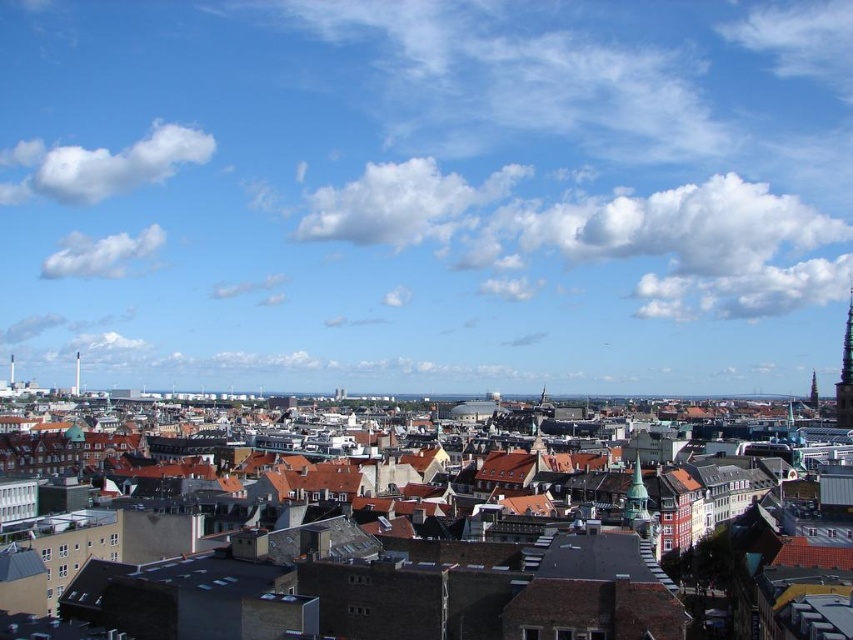
Question: Which object is closer to the camera taking this photo?

Choices:
 (A) dark gray stone tower at upper right
 (B) green metallic tower at center

Answer: (B)

Question: Is green metallic tower at center positioned behind dark gray stone tower at upper right?

Choices:
 (A) no
 (B) yes

Answer: (A)

Question: Is green metallic tower at center further to camera compared to dark gray stone tower at upper right?

Choices:
 (A) no
 (B) yes

Answer: (A)

Question: Is green metallic tower at center smaller than dark gray stone tower at upper right?

Choices:
 (A) yes
 (B) no

Answer: (A)

Question: Which of the following is the closest to the observer?

Choices:
 (A) (839, 392)
 (B) (625, 508)

Answer: (B)